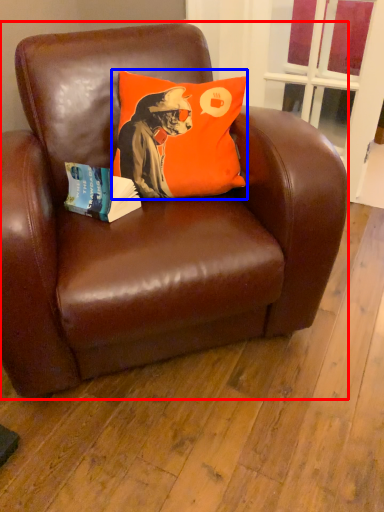
Question: Among these objects, which one is nearest to the camera, chair (highlighted by a red box) or pillow (highlighted by a blue box)?

Choices:
 (A) chair
 (B) pillow

Answer: (A)